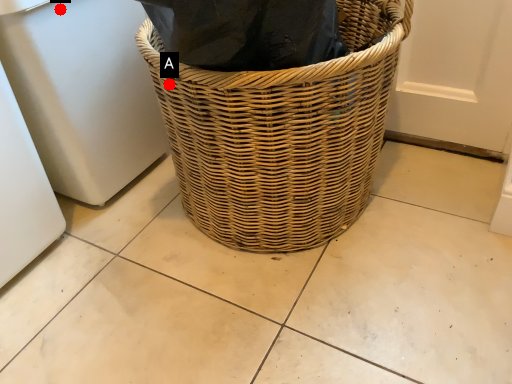
Question: Two points are circled on the image, labeled by A and B beside each circle. Which point is closer to the camera taking this photo?

Choices:
 (A) A is closer
 (B) B is closer

Answer: (A)